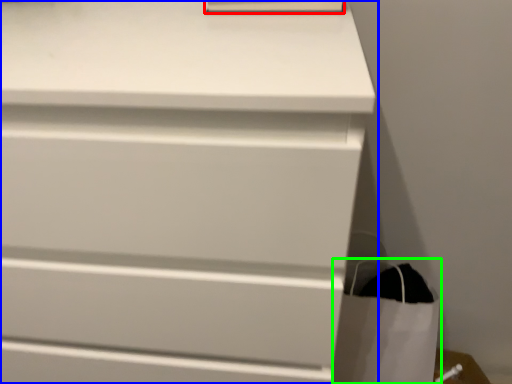
Question: Estimate the real-world distances between objects in this image. Which object is closer to paperback book (highlighted by a red box), chest of drawers (highlighted by a blue box) or shopping bag (highlighted by a green box)?

Choices:
 (A) chest of drawers
 (B) shopping bag

Answer: (A)